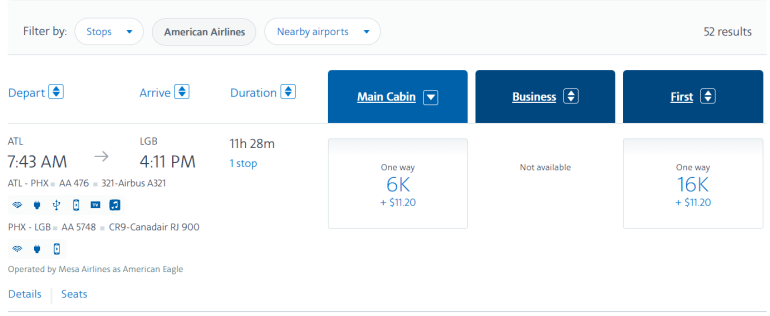
The width and height of the screenshot is (770, 316). I want to click on seats button, so [x=74, y=296].